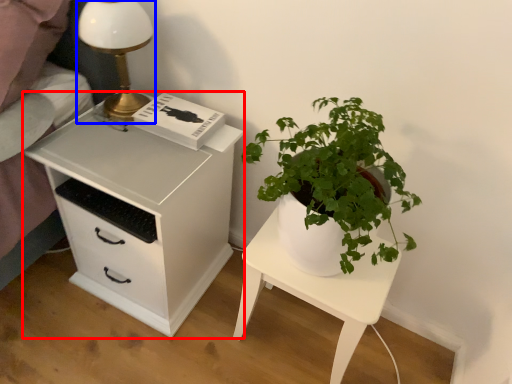
Question: Among these objects, which one is nearest to the camera, chest of drawers (highlighted by a red box) or table lamp (highlighted by a blue box)?

Choices:
 (A) chest of drawers
 (B) table lamp

Answer: (A)